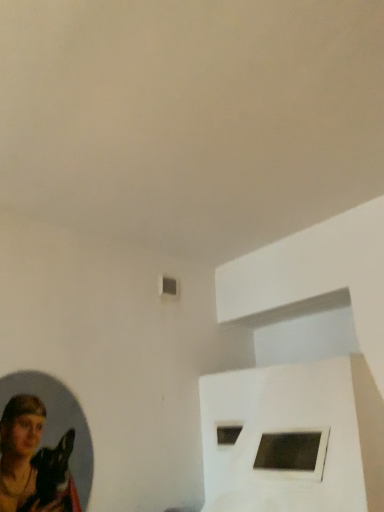
What do you see at coordinates (32, 460) in the screenshot? I see `matte gold necklace at lower left` at bounding box center [32, 460].

At what (x,y) coordinates should I click in order to perform the action: click on matte gold necklace at lower left. Please return your answer as a coordinate pair (x, y). Image resolution: width=384 pixels, height=512 pixels. Looking at the image, I should click on (32, 460).

Where is `matte gold necklace at lower left`? matte gold necklace at lower left is located at coordinates (32, 460).